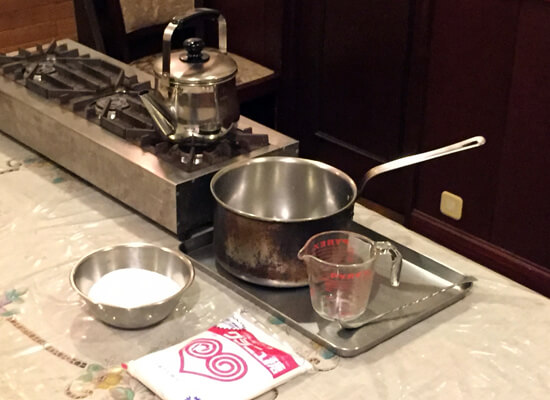
Find the location of a particular element. This screenshot has width=550, height=400. kettle is located at coordinates (202, 109).